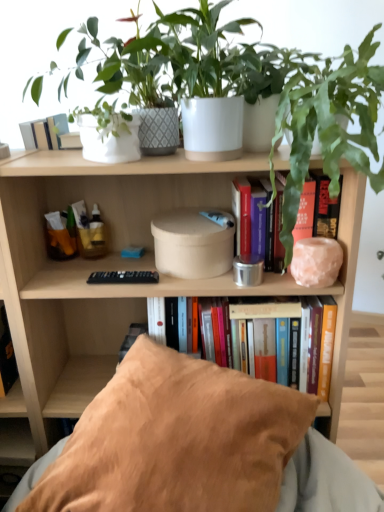
Question: Considering the positions of green leafy plant at upper right, the 1th houseplant when ordered from right to left, and beige fabric pillow at lower center in the image, is green leafy plant at upper right, the 1th houseplant when ordered from right to left, wider or thinner than beige fabric pillow at lower center?

Choices:
 (A) thin
 (B) wide

Answer: (B)

Question: Considering the relative positions of green leafy plant at upper right, which is counted as the second houseplant, starting from the left, and beige fabric pillow at lower center in the image provided, is green leafy plant at upper right, which is counted as the second houseplant, starting from the left, to the left or to the right of beige fabric pillow at lower center?

Choices:
 (A) left
 (B) right

Answer: (B)

Question: Which is nearer to the green leafy plant at upper right, which is counted as the second houseplant, starting from the left?

Choices:
 (A) hardcover book at center, the 1th book from the bottom
 (B) beige fabric pillow at lower center
 (C) white ceramic pot at upper center, which appears as the 2th houseplant when viewed from the right
 (D) hardcover book at center, the 1th book viewed from the top
 (E) matte cardboard box at center

Answer: (D)

Question: Estimate the real-world distances between objects in this image. Which object is closer to the beige fabric pillow at lower center?

Choices:
 (A) hardcover book at center, the 1th book viewed from the top
 (B) matte cardboard box at center
 (C) hardcover book at center, the 2th book when ordered from top to bottom
 (D) white ceramic pot at upper center, which appears as the 2th houseplant when viewed from the right
 (E) green leafy plant at upper right, the 1th houseplant when ordered from right to left

Answer: (C)